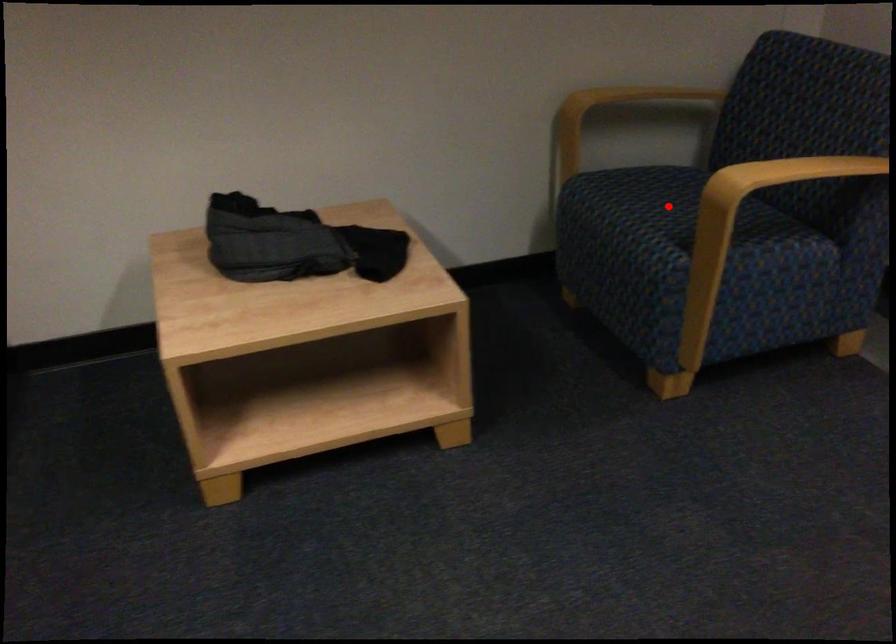
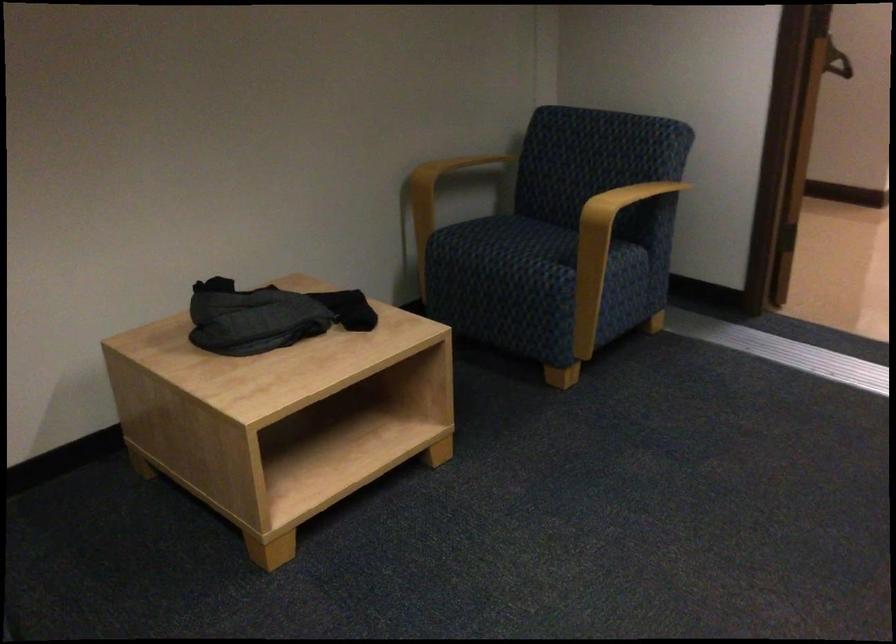
Locate, in the second image, the point that corresponds to the highlighted location in the first image.

(523, 242)